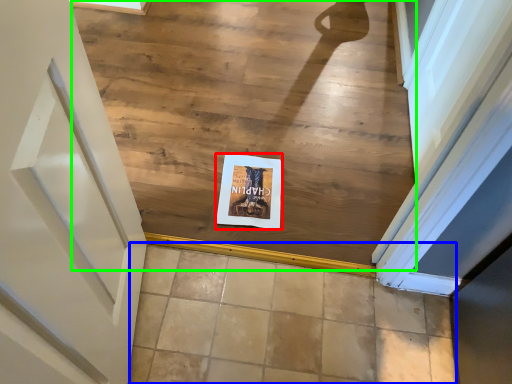
Question: Which object is positioned farthest from postcard (highlighted by a red box)? Select from tile (highlighted by a blue box) and stairwell (highlighted by a green box).

Choices:
 (A) tile
 (B) stairwell

Answer: (B)